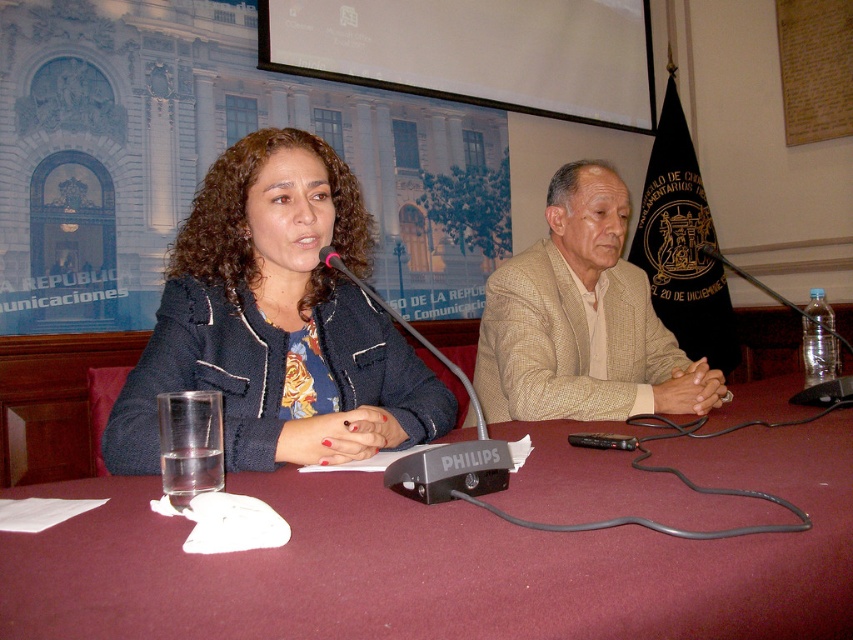
Who is more distant from viewer, [152,468] or [573,330]?

The point [573,330] is behind.

Does matte black jacket at center appear under beige textured blazer at center?

Incorrect, matte black jacket at center is not positioned below beige textured blazer at center.

Between point (270, 381) and point (560, 326), which one is positioned behind?

Positioned behind is point (560, 326).

The image size is (853, 640). Find the location of `matte black jacket at center`. matte black jacket at center is located at coordinates 276,321.

Image resolution: width=853 pixels, height=640 pixels. Identify the location of maroon fabric table at center. (445, 561).

Who is positioned more to the left, maroon fabric table at center or matte black jacket at center?

matte black jacket at center is more to the left.

You are a GUI agent. You are given a task and a screenshot of the screen. Output one action in this format:
    pyautogui.click(x=<x>, y=<y>)
    Task: Click on the maroon fabric table at center
    Image resolution: width=853 pixels, height=640 pixels.
    Given the screenshot: What is the action you would take?
    pyautogui.click(x=445, y=561)

The height and width of the screenshot is (640, 853). In order to click on maroon fabric table at center in this screenshot , I will do `click(445, 561)`.

Is point (508, 561) farther from camera compared to point (653, 385)?

No, (508, 561) is closer to viewer.

Is point (190, 580) positioned behind point (590, 192)?

No, (190, 580) is in front of (590, 192).

Find the location of a particular element. The height and width of the screenshot is (640, 853). maroon fabric table at center is located at coordinates (445, 561).